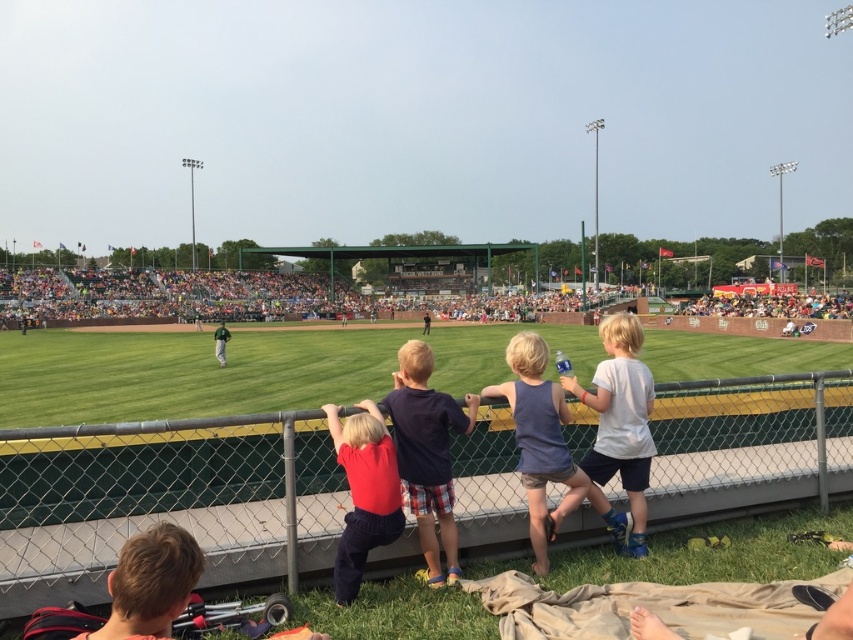
Is green grass baseball field at center positioned at the back of dark blue t-shirt at center?

Yes.

In the scene shown: Can you confirm if green grass baseball field at center is wider than dark blue t-shirt at center?

Indeed, green grass baseball field at center has a greater width compared to dark blue t-shirt at center.

Where is `green grass baseball field at center`? Image resolution: width=853 pixels, height=640 pixels. green grass baseball field at center is located at coordinates (262, 300).

Does dark blue t-shirt at center appear over blonde hair at lower left?

Correct, dark blue t-shirt at center is located above blonde hair at lower left.

Who is more forward, (405, 352) or (183, 540)?

Positioned in front is point (183, 540).

Between point (397, 452) and point (160, 557), which one is positioned in front?

Point (160, 557)

Find the location of a particular element. The height and width of the screenshot is (640, 853). dark blue t-shirt at center is located at coordinates (427, 452).

Is blue cotton tank top at center in front of blonde hair at lower left?

A: No, it is behind blonde hair at lower left.

Which is more to the right, blue cotton tank top at center or blonde hair at lower left?

blue cotton tank top at center is more to the right.

The height and width of the screenshot is (640, 853). In order to click on blue cotton tank top at center in this screenshot , I will do `click(538, 440)`.

Find the location of a particular element. blue cotton tank top at center is located at coordinates (538, 440).